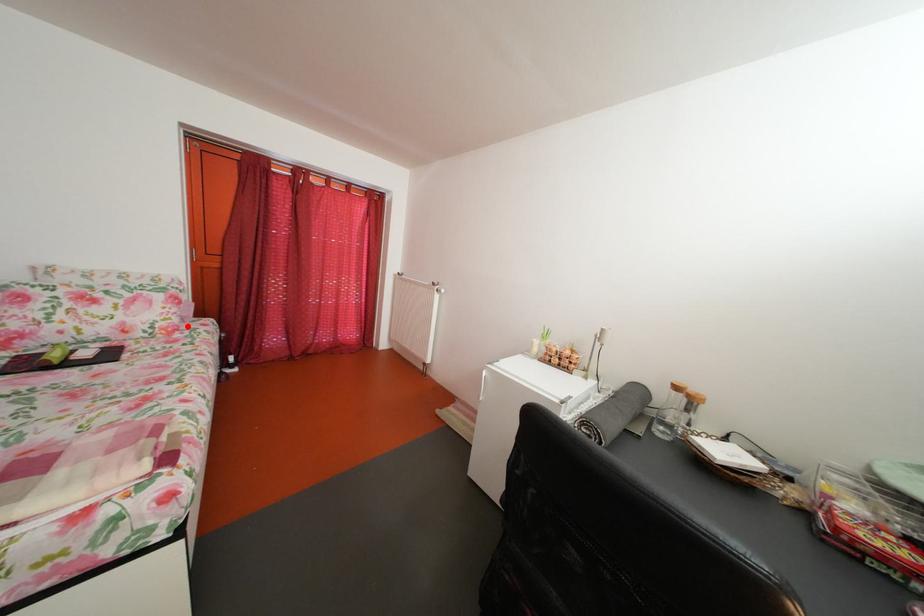
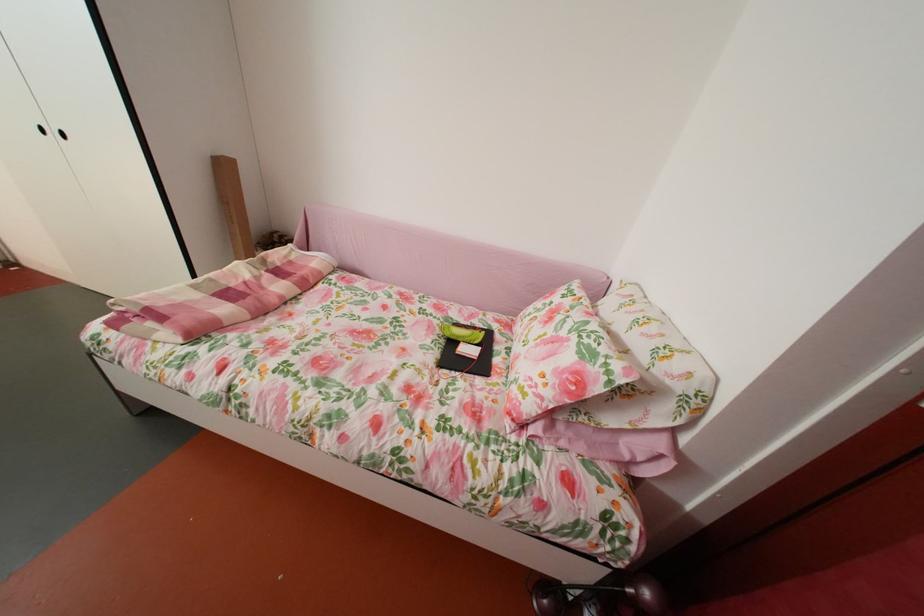
Question: I am providing you with two images of the same scene from different viewpoints. A red point is shown in image1. For the corresponding object point in image2, is it positioned nearer or farther from the camera?

Choices:
 (A) Nearer
 (B) Farther

Answer: (B)